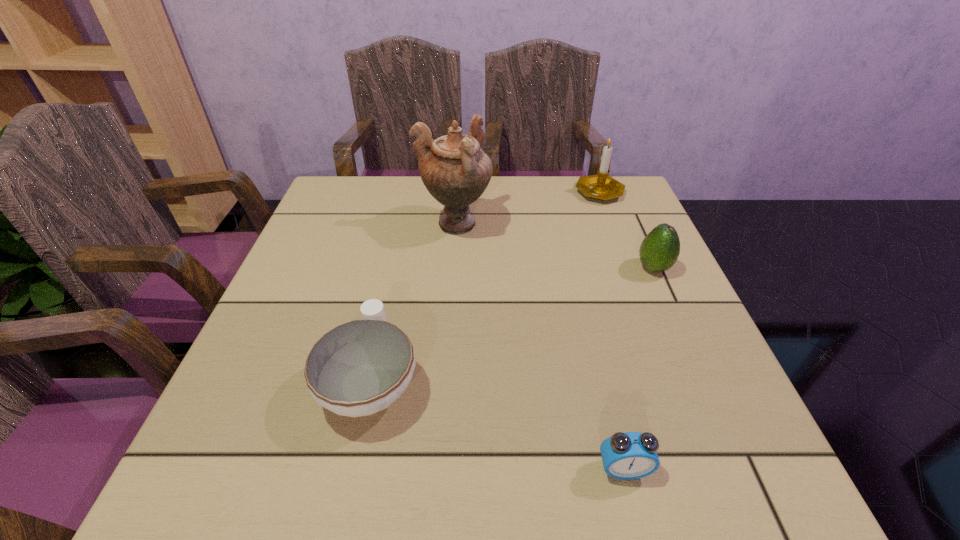
Identify the location of free location that satisfies the following two spatial constraints: 1. on the side with the handle of the second nearest object; 2. on the right side of the urn. (405, 224).

The height and width of the screenshot is (540, 960). I want to click on blank area in the image that satisfies the following two spatial constraints: 1. on the side with the handle of the chinaware; 2. on the left side of the second tallest object, so click(x=413, y=191).